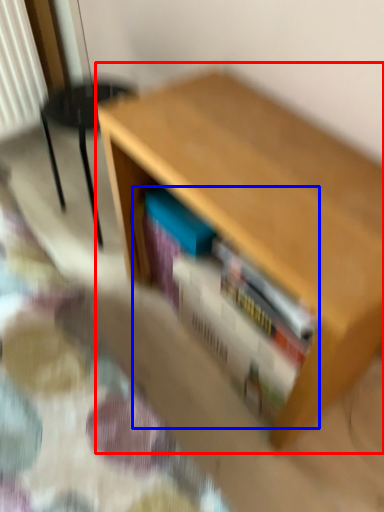
Question: Which of the following is the farthest to the observer, table (highlighted by a red box) or book (highlighted by a blue box)?

Choices:
 (A) table
 (B) book

Answer: (B)